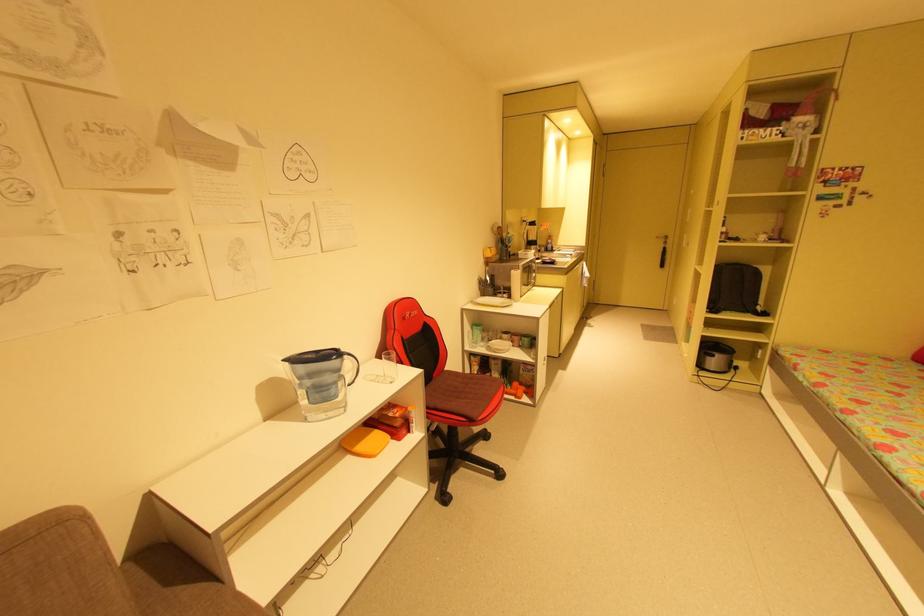
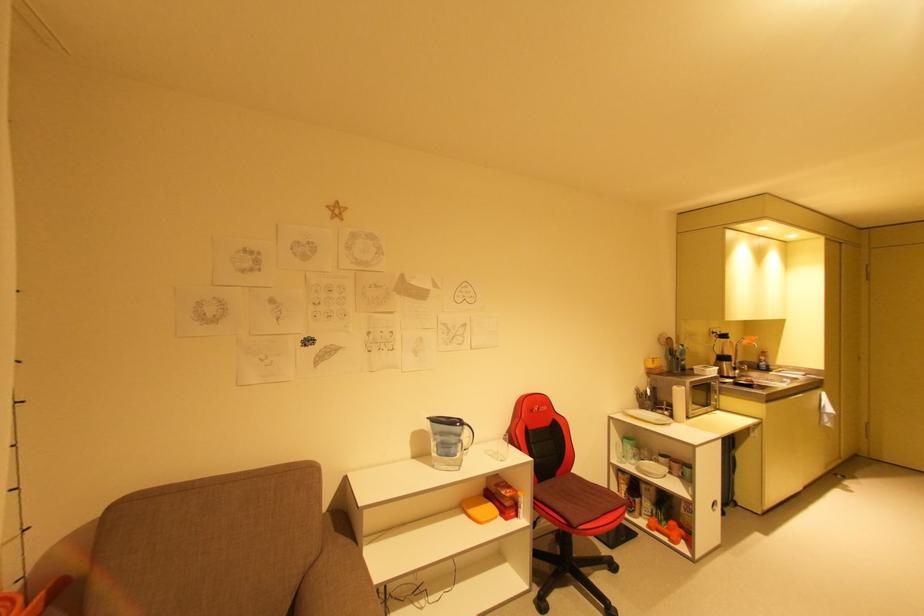
Question: How did the camera likely rotate?

Choices:
 (A) Left
 (B) Right
 (C) Up
 (D) Down

Answer: (A)